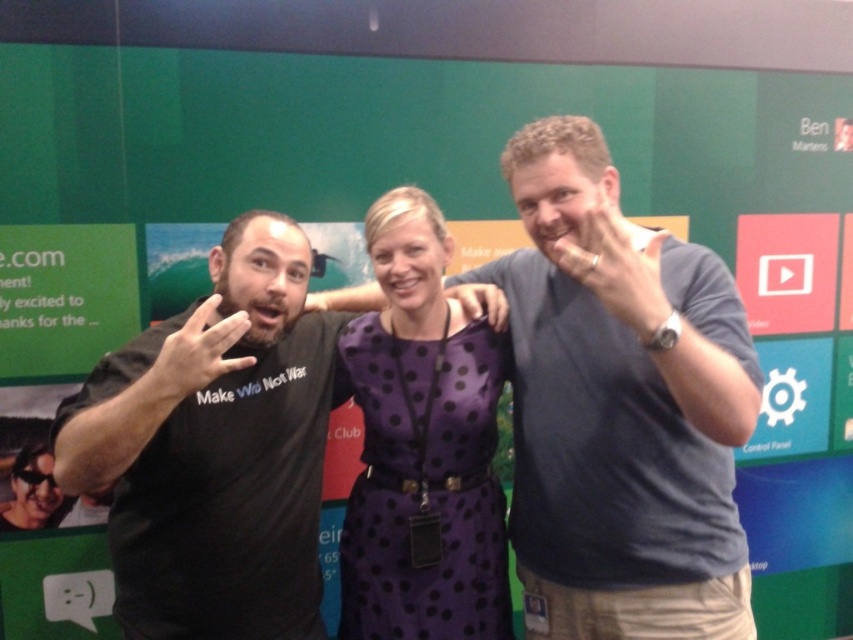
Question: Can you confirm if silver metallic ring at upper center is wider than matte black t-shirt at left?

Choices:
 (A) yes
 (B) no

Answer: (A)

Question: Which is nearer to the matte purple dress at center?

Choices:
 (A) dark blue shirt at center
 (B) matte black hand at left
 (C) purple satin dress at center

Answer: (C)

Question: Does dark blue shirt at center have a larger size compared to matte black hand at left?

Choices:
 (A) no
 (B) yes

Answer: (B)

Question: Which of the following is the farthest from the observer?

Choices:
 (A) (399, 211)
 (B) (155, 369)
 (C) (596, 209)

Answer: (A)

Question: Which object is the farthest from the silver metallic ring at upper center?

Choices:
 (A) matte black t-shirt at left
 (B) dark blue shirt at center
 (C) black matte t-shirt at left
 (D) matte purple dress at center

Answer: (A)

Question: Does purple satin dress at center have a lesser width compared to matte black t-shirt at left?

Choices:
 (A) yes
 (B) no

Answer: (B)